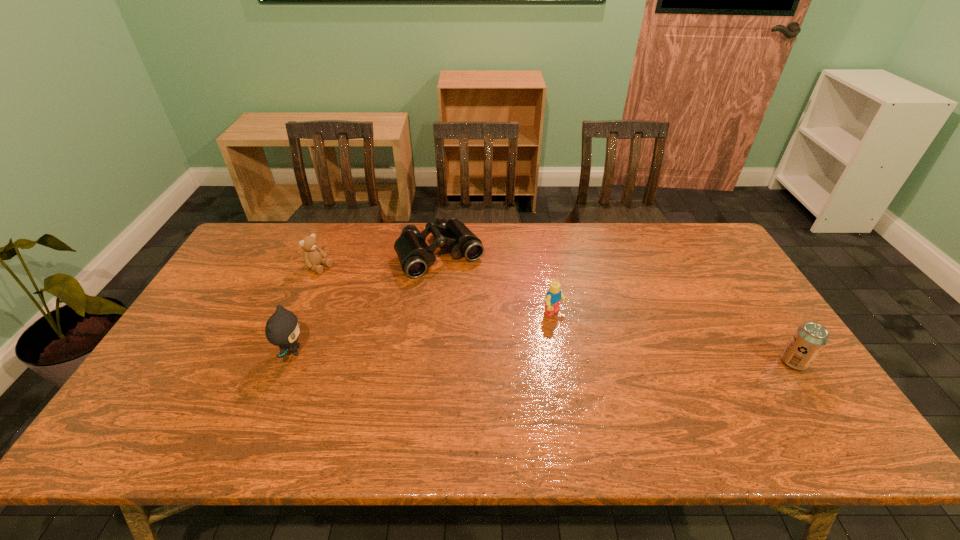
This screenshot has height=540, width=960. Find the location of `vacant space at the far edge of the desktop`. vacant space at the far edge of the desktop is located at coordinates (645, 227).

Locate an element on the screen. free location at the near edge is located at coordinates (306, 401).

In the image, there is a desktop. Where is `free space at the left edge`? The image size is (960, 540). free space at the left edge is located at coordinates (207, 329).

Identify the location of vacant space at the right edge of the desktop. Image resolution: width=960 pixels, height=540 pixels. (784, 363).

Locate an element on the screen. free space at the far left corner of the desktop is located at coordinates (255, 258).

Identify the location of free space at the near right corner of the desktop. This screenshot has width=960, height=540. (778, 401).

You are a GUI agent. You are given a task and a screenshot of the screen. Output one action in this format:
    pyautogui.click(x=<x>, y=<y>)
    Task: Click on the free space that is in between the teddy bear and the beer can
    The height and width of the screenshot is (540, 960).
    Given the screenshot: What is the action you would take?
    pyautogui.click(x=557, y=315)

Locate an element on the screen. The width and height of the screenshot is (960, 540). vacant region between the rightmost object and the teddy bear is located at coordinates (557, 315).

The width and height of the screenshot is (960, 540). Identify the location of free space between the kitten and the binoculars. (366, 303).

Find the location of a particular element. The image size is (960, 540). blank region between the teddy bear and the kitten is located at coordinates (306, 309).